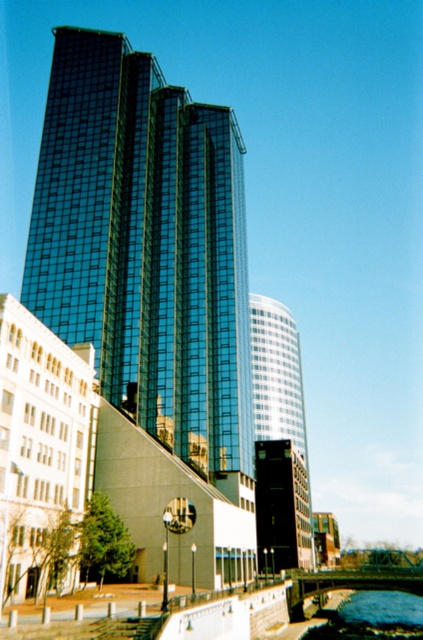
You are standing at the exact center of the image. Which direction should you move to reach the glassy reflective skyscraper at center?

Since the glassy reflective skyscraper at center is already at the center of the image, you don not need to move in any direction. You are already facing it.

You are standing at the camera position and want to take a photo of the glassy reflective skyscraper at center. If your camera can focus on objects up to 250 feet away, will you be able to capture it clearly?

The glassy reflective skyscraper at center is 245.88 feet from camera, so yes, the camera can focus on it clearly since it is within the 250 feet range.

Consider the image. You are standing in the urban landscape and want to take a photo of the glassy reflective skyscraper at center and the blue glassy water at lower center. Which object should you focus on first if you want both to be in sharp focus?

You should focus on the glassy reflective skyscraper at center first because it is closer to the viewer than the blue glassy water at lower center. By focusing on the closer object, the background object may still be in acceptable focus depending on the aperture used.